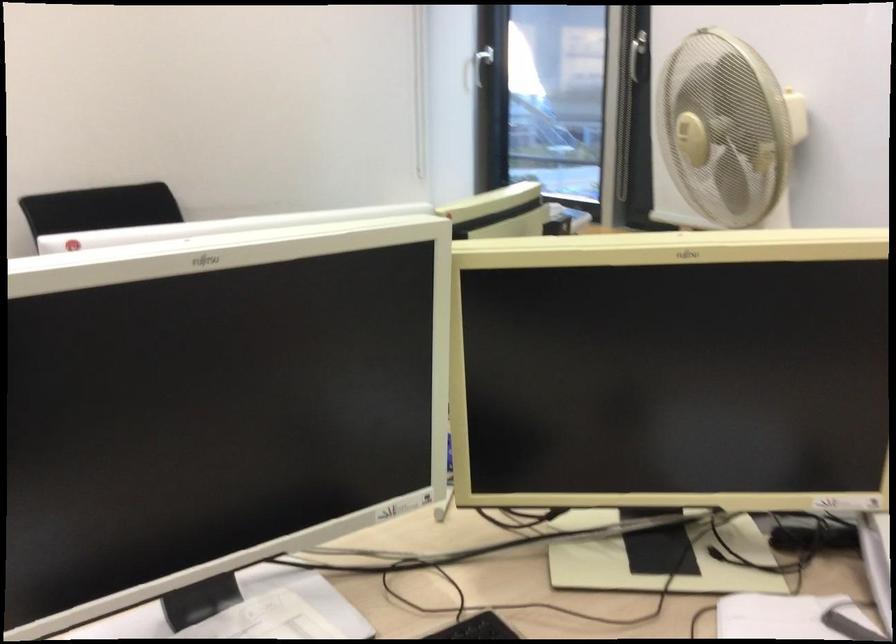
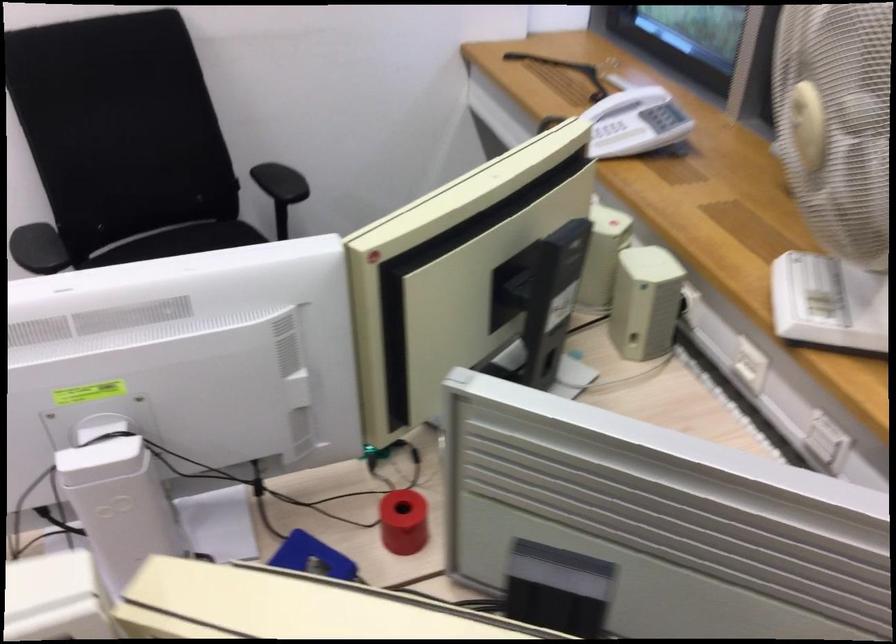
Question: How did the camera likely rotate?

Choices:
 (A) Left
 (B) Right
 (C) Up
 (D) Down

Answer: (D)